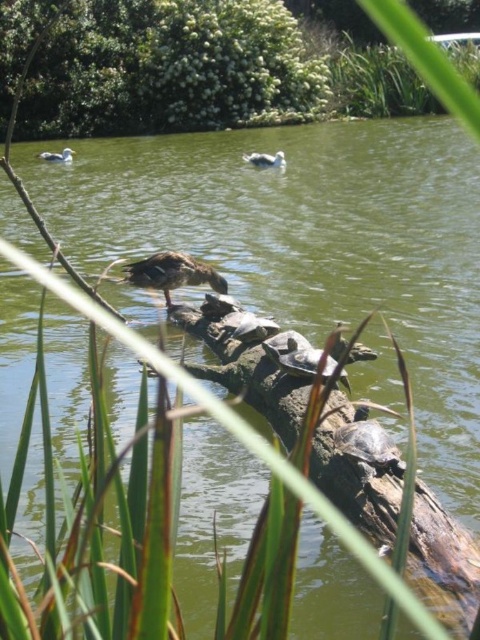
In the scene shown: You are a photographer aiming to capture the smooth gray turtle at center and the white matte duck at upper center in a single shot. Based on their positions, which one will appear closer to the camera in the photo?

The smooth gray turtle at center appears closer to the camera because it is positioned in front of the white matte duck at upper center.

You are a photographer trying to capture a clear shot of the smooth gray turtle at center without the green leafy bush at upper center blocking the view. Based on their positions, can you adjust your camera angle to achieve this?

The green leafy bush at upper center is located above the smooth gray turtle at center, so lowering the camera angle or moving the camera position lower could help avoid the bush blocking the turtle.

You are an animal observer trying to determine which object in the scene is bigger. You see the brown rough tree trunk at center and the matte gray duck at upper left. Which one is bigger?

The brown rough tree trunk at center is larger in size than the matte gray duck at upper left, so the brown rough tree trunk at center is bigger.